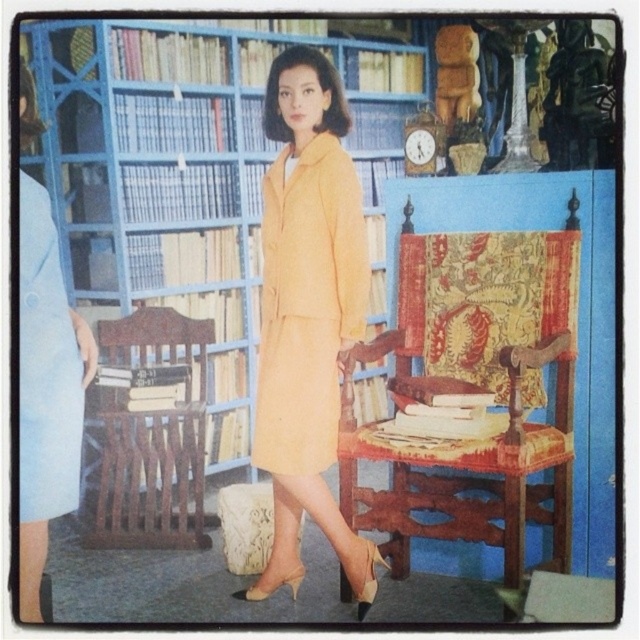
Question: Which point is closer to the camera taking this photo?

Choices:
 (A) (554, 452)
 (B) (264, 301)

Answer: (A)

Question: Based on their relative distances, which object is farther from the matte blue bookcase at upper center?

Choices:
 (A) brown wooden chair at left
 (B) light blue fabric skirt at left
 (C) matte yellow dress at center

Answer: (B)

Question: Can you confirm if matte blue bookcase at upper center is positioned below light blue fabric skirt at left?

Choices:
 (A) no
 (B) yes

Answer: (A)

Question: Which point is farther to the camera?

Choices:
 (A) (280, 209)
 (B) (104, 490)
 (C) (483, 467)
 (D) (276, 266)

Answer: (B)

Question: Can you confirm if matte blue bookcase at upper center is bigger than wooden armchair with patterned upholstery at center?

Choices:
 (A) yes
 (B) no

Answer: (A)

Question: Does matte yellow suit at center have a lesser width compared to brown wooden chair at left?

Choices:
 (A) yes
 (B) no

Answer: (A)